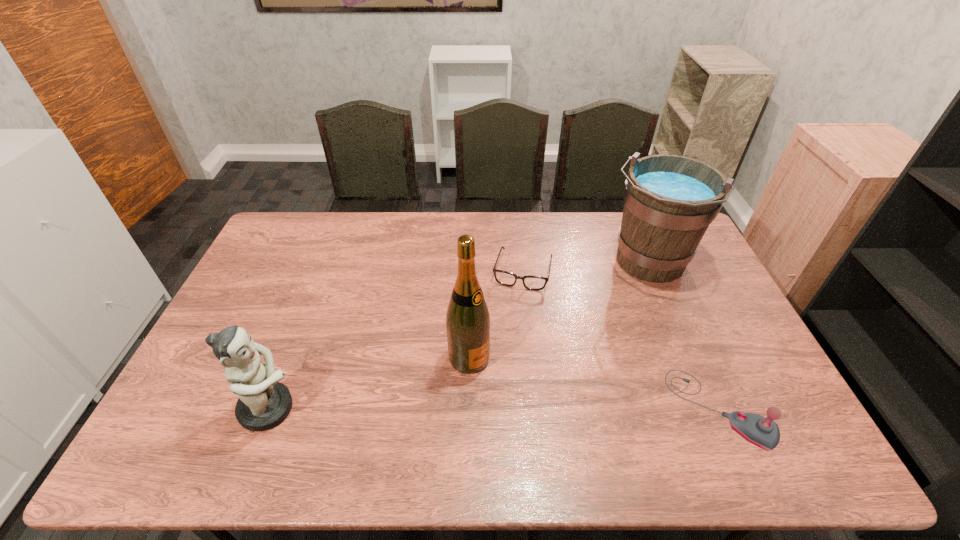
Identify the location of the leftmost object. The height and width of the screenshot is (540, 960). (264, 403).

Image resolution: width=960 pixels, height=540 pixels. In order to click on figurine in this screenshot , I will do `click(264, 403)`.

Find the location of `joystick`. joystick is located at coordinates (763, 432).

Locate an element on the screen. This screenshot has height=540, width=960. the shortest object is located at coordinates (505, 278).

You are a GUI agent. You are given a task and a screenshot of the screen. Output one action in this format:
    pyautogui.click(x=<x>, y=<y>)
    Task: Click on the spectacles
    
    Given the screenshot: What is the action you would take?
    pyautogui.click(x=505, y=278)

Locate an element on the screen. wine bucket is located at coordinates (669, 200).

You are a GUI agent. You are given a task and a screenshot of the screen. Output one action in this format:
    pyautogui.click(x=<x>, y=<y>)
    Task: Click on the wine bottle
    The width and height of the screenshot is (960, 540).
    Given the screenshot: What is the action you would take?
    pyautogui.click(x=468, y=318)

Locate an element on the screen. free space located 0.050m on the front-facing side of the third tallest object is located at coordinates (320, 408).

I want to click on vacant space positioned on the right of the fourth tallest object, so click(x=787, y=409).

This screenshot has height=540, width=960. I want to click on vacant point located 0.280m on the front-facing side of the shortest object, so click(x=500, y=359).